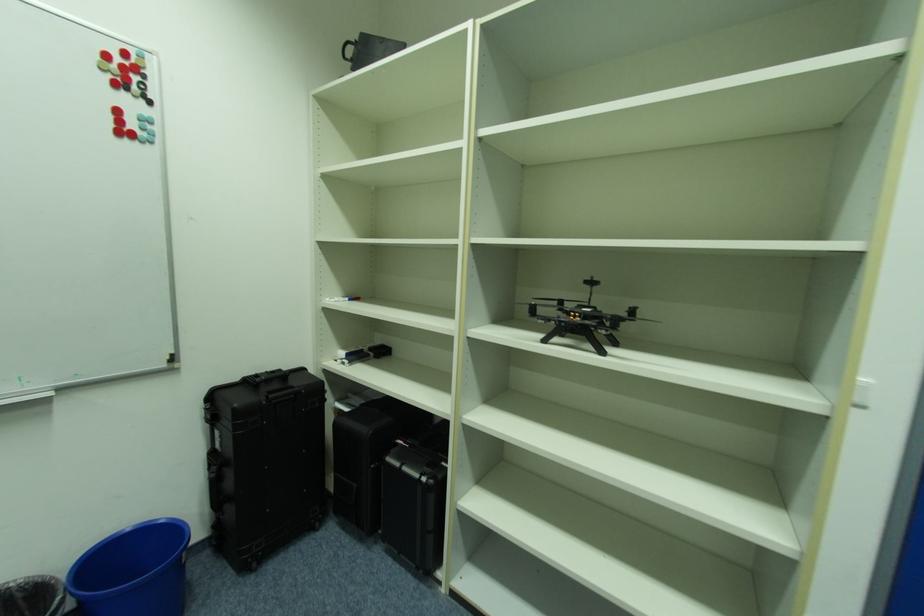
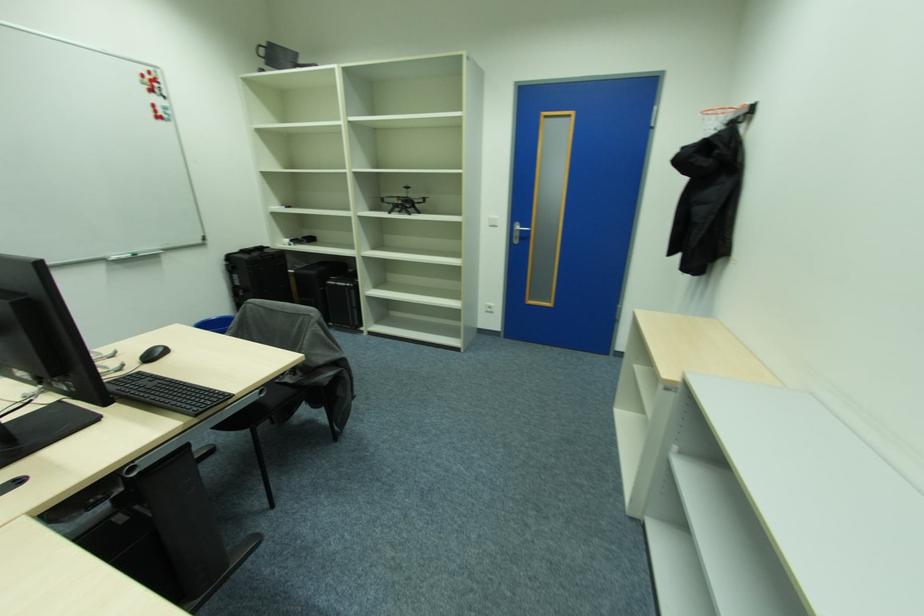
Question: What movement of the cameraman would produce the second image?

Choices:
 (A) Left
 (B) Right
 (C) Forward
 (D) Backward

Answer: (D)